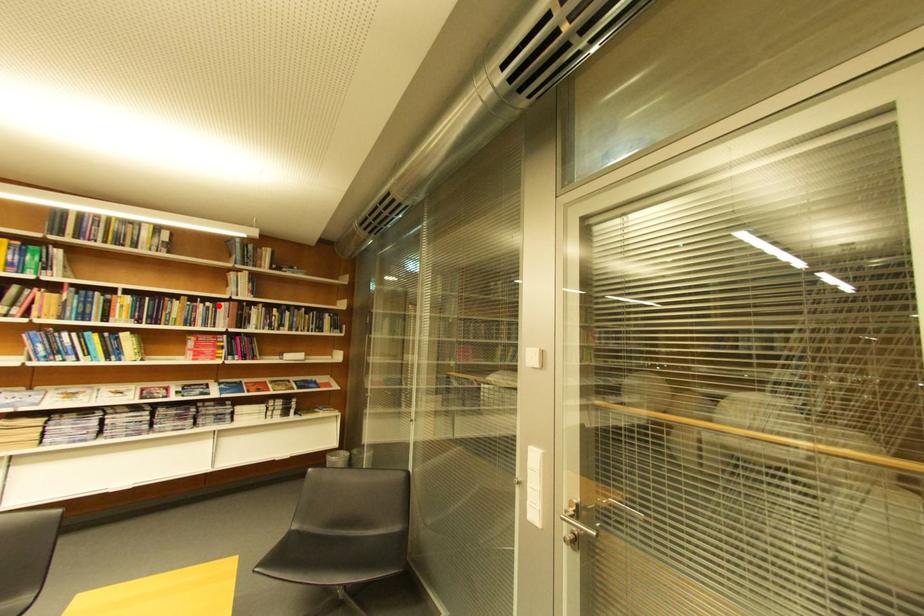
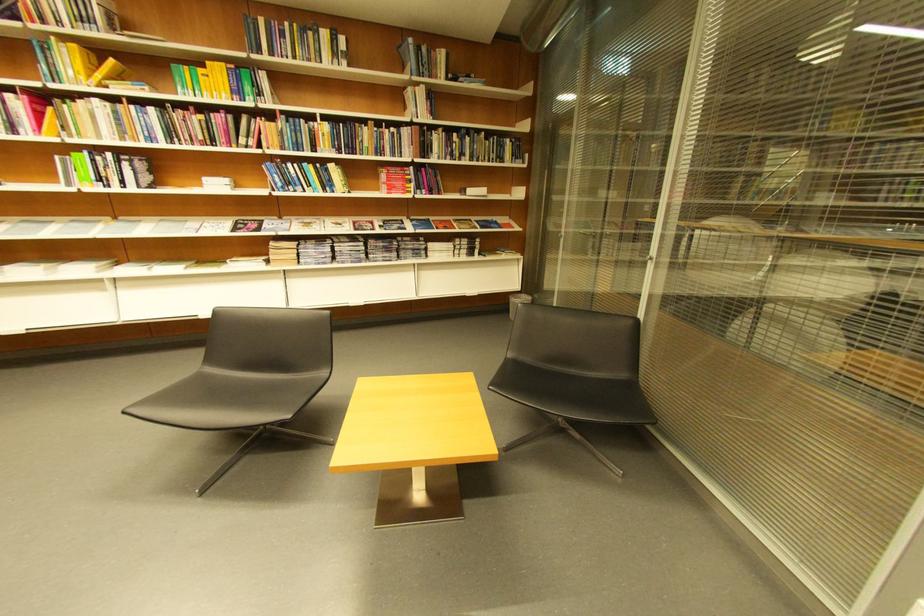
Question: I am providing you with two images of the same scene from different viewpoints. A red point is shown in image1. For the corresponding object point in image2, is it positioned nearer or farther from the camera?

Choices:
 (A) Nearer
 (B) Farther

Answer: (A)